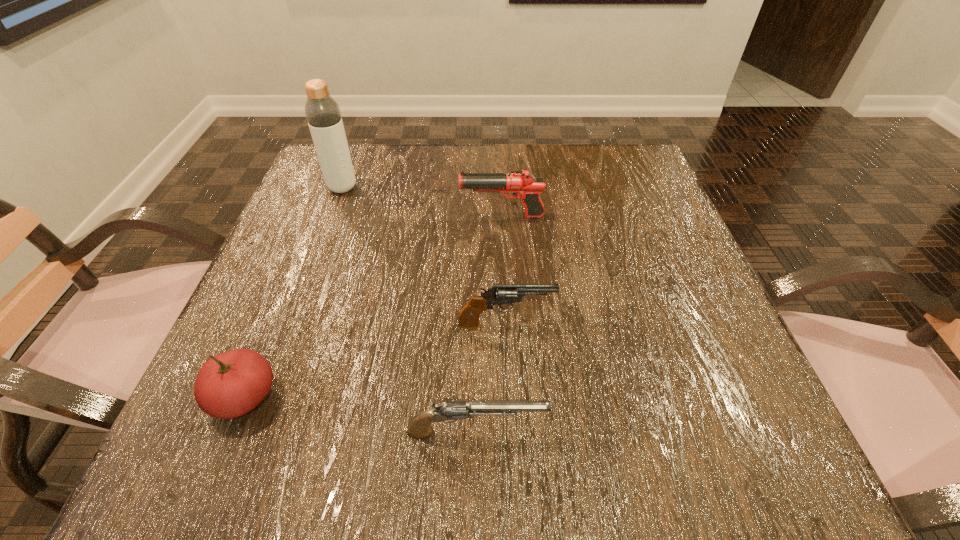
Locate an element on the screen. empty space between the shortest gun and the second farthest gun is located at coordinates (491, 378).

At what (x,y) coordinates should I click in order to perform the action: click on vacant region between the second nearest gun and the tomato. Please return your answer as a coordinate pair (x, y). Looking at the image, I should click on (375, 361).

At what (x,y) coordinates should I click in order to perform the action: click on unoccupied area between the farthest gun and the shortest gun. Please return your answer as a coordinate pair (x, y). This screenshot has height=540, width=960. Looking at the image, I should click on (489, 324).

The width and height of the screenshot is (960, 540). I want to click on vacant area that lies between the second farthest gun and the second farthest object, so coord(504,270).

In order to click on vacant space in between the tomato and the farthest gun in this screenshot , I will do `click(373, 307)`.

Identify the location of vacant space in between the second nearest gun and the farthest gun. The height and width of the screenshot is (540, 960). (504, 270).

Identify which object is located as the nearest to the tomato. Please provide its 2D coordinates. Your answer should be formatted as a tuple, i.e. [(x, y)], where the tuple contains the x and y coordinates of a point satisfying the conditions above.

[(448, 411)]

Locate which object is the third closest to the fourth nearest object. Please provide its 2D coordinates. Your answer should be formatted as a tuple, i.e. [(x, y)], where the tuple contains the x and y coordinates of a point satisfying the conditions above.

[(231, 384)]

Identify which gun is the second nearest to the third nearest object. Please provide its 2D coordinates. Your answer should be formatted as a tuple, i.e. [(x, y)], where the tuple contains the x and y coordinates of a point satisfying the conditions above.

[(523, 184)]

The image size is (960, 540). Identify the location of gun identified as the second closest to the second farthest object. (448, 411).